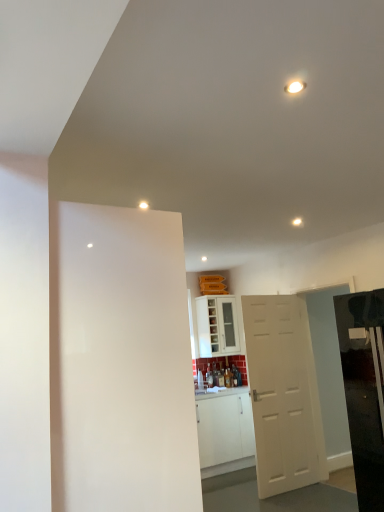
Question: Is white glossy light at upper center wider or thinner than white matte door at center, arranged as the second door when viewed from the left?

Choices:
 (A) wide
 (B) thin

Answer: (B)

Question: From the image's perspective, relative to white matte door at center, positioned as the 1th door in back-to-front order, is white glossy light at upper center above or below?

Choices:
 (A) above
 (B) below

Answer: (A)

Question: Which is farther from the white matte door at center, arranged as the 1th door when viewed from the right?

Choices:
 (A) glossy black refrigerator at right
 (B) white matte door at left, which is the 2th door from right to left
 (C) white glossy light at upper center
 (D) white glossy cabinet at center

Answer: (B)

Question: Which object is positioned closest to the white matte door at center, arranged as the second door when viewed from the left?

Choices:
 (A) white matte door at left, the 2th door positioned from the back
 (B) glossy black refrigerator at right
 (C) white glossy light at upper center
 (D) white glossy cabinet at center

Answer: (B)